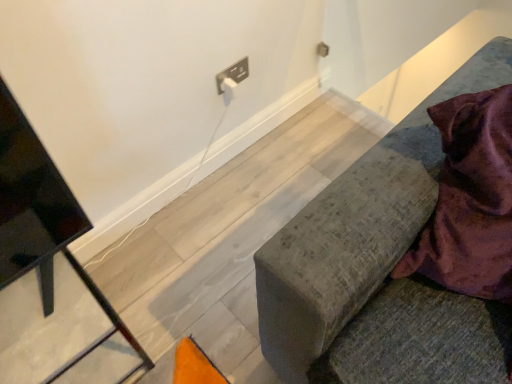
The image size is (512, 384). I want to click on black metal tv stand at left, which is counted as the 2th furniture, starting from the right, so click(50, 275).

The width and height of the screenshot is (512, 384). What do you see at coordinates (470, 200) in the screenshot?
I see `velvet purple blanket at right` at bounding box center [470, 200].

Measure the distance between velvet grey cushion at right, marked as the first furniture in a right-to-left arrangement, and camera.

28.21 inches.

Locate an element on the screen. This screenshot has height=384, width=512. black metal tv stand at left, acting as the 1th furniture starting from the left is located at coordinates (50, 275).

Who is shorter, velvet grey cushion at right, which is the 2th furniture from left to right, or velvet purple blanket at right?

velvet purple blanket at right.

Considering the sizes of objects velvet grey cushion at right, marked as the first furniture in a right-to-left arrangement, and velvet purple blanket at right in the image provided, who is bigger, velvet grey cushion at right, marked as the first furniture in a right-to-left arrangement, or velvet purple blanket at right?

velvet grey cushion at right, marked as the first furniture in a right-to-left arrangement.

Based on the photo, which object is further away from the camera taking this photo, velvet grey cushion at right, marked as the first furniture in a right-to-left arrangement, or velvet purple blanket at right?

Positioned behind is velvet purple blanket at right.

Which object is positioned more to the left, velvet grey cushion at right, which is the 2th furniture from left to right, or velvet purple blanket at right?

Positioned to the left is velvet grey cushion at right, which is the 2th furniture from left to right.

Does velvet purple blanket at right have a lesser height compared to black metal tv stand at left, acting as the 1th furniture starting from the left?

No, velvet purple blanket at right is not shorter than black metal tv stand at left, acting as the 1th furniture starting from the left.

In the image, is velvet purple blanket at right positioned in front of or behind black metal tv stand at left, which is counted as the 2th furniture, starting from the right?

velvet purple blanket at right is positioned closer to the viewer than black metal tv stand at left, which is counted as the 2th furniture, starting from the right.

Would you say velvet purple blanket at right contains black metal tv stand at left, which is counted as the 2th furniture, starting from the right?

No, black metal tv stand at left, which is counted as the 2th furniture, starting from the right, is not surrounded by velvet purple blanket at right.

From a real-world perspective, is velvet purple blanket at right beneath velvet grey cushion at right, which is the 2th furniture from left to right?

No, from a real-world perspective, velvet purple blanket at right is not under velvet grey cushion at right, which is the 2th furniture from left to right.

Is velvet purple blanket at right looking in the opposite direction of velvet grey cushion at right, which is the 2th furniture from left to right?

Yes, velvet purple blanket at right's orientation is away from velvet grey cushion at right, which is the 2th furniture from left to right.

From the image's perspective, does velvet purple blanket at right appear lower than velvet grey cushion at right, marked as the first furniture in a right-to-left arrangement?

No.

Considering the positions of objects velvet purple blanket at right and velvet grey cushion at right, which is the 2th furniture from left to right, in the image provided, who is behind, velvet purple blanket at right or velvet grey cushion at right, which is the 2th furniture from left to right,?

velvet purple blanket at right is further from the camera.

Can you confirm if black metal tv stand at left, acting as the 1th furniture starting from the left, is shorter than velvet grey cushion at right, which is the 2th furniture from left to right?

Correct, black metal tv stand at left, acting as the 1th furniture starting from the left, is not as tall as velvet grey cushion at right, which is the 2th furniture from left to right.

Does black metal tv stand at left, acting as the 1th furniture starting from the left, have a smaller size compared to velvet grey cushion at right, which is the 2th furniture from left to right?

Yes.

Can velvet grey cushion at right, marked as the first furniture in a right-to-left arrangement, be found inside black metal tv stand at left, which is counted as the 2th furniture, starting from the right?

Definitely not — velvet grey cushion at right, marked as the first furniture in a right-to-left arrangement, is not inside black metal tv stand at left, which is counted as the 2th furniture, starting from the right.

Is black metal tv stand at left, which is counted as the 2th furniture, starting from the right, with velvet grey cushion at right, marked as the first furniture in a right-to-left arrangement?

black metal tv stand at left, which is counted as the 2th furniture, starting from the right, is not next to velvet grey cushion at right, marked as the first furniture in a right-to-left arrangement, and they're not touching.

Does point (342, 179) lie behind point (63, 373)?

No, (342, 179) is closer to viewer.

Is velvet grey cushion at right, marked as the first furniture in a right-to-left arrangement, facing away from black metal tv stand at left, acting as the 1th furniture starting from the left?

No.

In terms of size, does velvet grey cushion at right, marked as the first furniture in a right-to-left arrangement, appear bigger or smaller than black metal tv stand at left, acting as the 1th furniture starting from the left?

Clearly, velvet grey cushion at right, marked as the first furniture in a right-to-left arrangement, is larger in size than black metal tv stand at left, acting as the 1th furniture starting from the left.

From the image's perspective, which is above, velvet grey cushion at right, marked as the first furniture in a right-to-left arrangement, or black metal tv stand at left, acting as the 1th furniture starting from the left?

velvet grey cushion at right, marked as the first furniture in a right-to-left arrangement, appears higher in the image.

From the image's perspective, is black metal tv stand at left, acting as the 1th furniture starting from the left, on top of velvet purple blanket at right?

No, from the image's perspective, black metal tv stand at left, acting as the 1th furniture starting from the left, is not on top of velvet purple blanket at right.

Find the location of a particular element. Image resolution: width=512 pixels, height=384 pixels. the 2nd furniture directly beneath the velvet purple blanket at right (from a real-world perspective) is located at coordinates (50, 275).

From the picture: Is black metal tv stand at left, acting as the 1th furniture starting from the left, touching velvet purple blanket at right?

No, black metal tv stand at left, acting as the 1th furniture starting from the left, is not touching velvet purple blanket at right.

Consider the image. Which of these two, black metal tv stand at left, acting as the 1th furniture starting from the left, or velvet purple blanket at right, is smaller?

velvet purple blanket at right is smaller.

Where is `blanket that is above the velvet grey cushion at right, which is the 2th furniture from left to right (from the image's perspective)`? This screenshot has width=512, height=384. blanket that is above the velvet grey cushion at right, which is the 2th furniture from left to right (from the image's perspective) is located at coordinates (470, 200).

Locate an element on the screen. the 2nd furniture below the velvet purple blanket at right (from the image's perspective) is located at coordinates (50, 275).

From the image, which object appears to be nearer to velvet purple blanket at right, velvet grey cushion at right, marked as the first furniture in a right-to-left arrangement, or black metal tv stand at left, acting as the 1th furniture starting from the left?

velvet grey cushion at right, marked as the first furniture in a right-to-left arrangement.

Looking at this image, based on their spatial positions, is black metal tv stand at left, acting as the 1th furniture starting from the left, or velvet grey cushion at right, marked as the first furniture in a right-to-left arrangement, closer to velvet purple blanket at right?

velvet grey cushion at right, marked as the first furniture in a right-to-left arrangement, is closer to velvet purple blanket at right.

Which object lies further to the anchor point black metal tv stand at left, which is counted as the 2th furniture, starting from the right, velvet grey cushion at right, which is the 2th furniture from left to right, or velvet purple blanket at right?

Based on the image, velvet purple blanket at right appears to be further to black metal tv stand at left, which is counted as the 2th furniture, starting from the right.

Which object lies nearer to the anchor point velvet grey cushion at right, which is the 2th furniture from left to right, velvet purple blanket at right or black metal tv stand at left, which is counted as the 2th furniture, starting from the right?

velvet purple blanket at right is closer to velvet grey cushion at right, which is the 2th furniture from left to right.

Looking at the image, which one is located further to velvet grey cushion at right, which is the 2th furniture from left to right, black metal tv stand at left, which is counted as the 2th furniture, starting from the right, or velvet purple blanket at right?

Among the two, black metal tv stand at left, which is counted as the 2th furniture, starting from the right, is located further to velvet grey cushion at right, which is the 2th furniture from left to right.

From the image, which object appears to be nearer to black metal tv stand at left, acting as the 1th furniture starting from the left, velvet purple blanket at right or velvet grey cushion at right, which is the 2th furniture from left to right?

velvet grey cushion at right, which is the 2th furniture from left to right.

In order to click on furniture between black metal tv stand at left, acting as the 1th furniture starting from the left, and velvet purple blanket at right, in the horizontal direction in this screenshot , I will do click(379, 268).